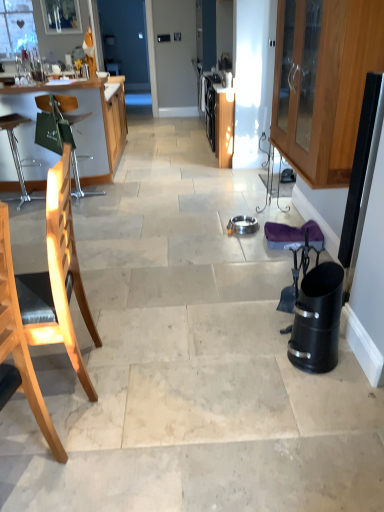
Where is `empty space that is to the right of light wood chair at left, the second chair positioned from the front`? The height and width of the screenshot is (512, 384). empty space that is to the right of light wood chair at left, the second chair positioned from the front is located at coordinates (133, 373).